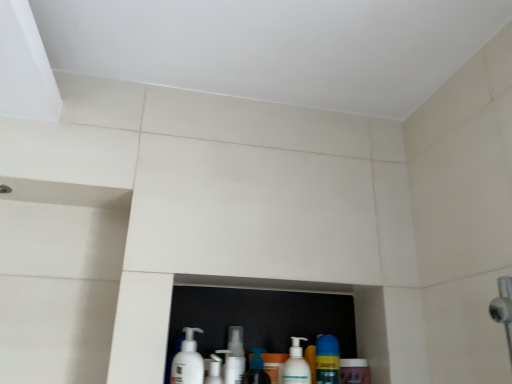
The image size is (512, 384). What do you see at coordinates (281, 314) in the screenshot?
I see `white plastic bottles at lower center` at bounding box center [281, 314].

Measure the distance between yellow matte bottle at lower center, the 5th cleaning product when ordered from left to right, and camera.

36.06 inches.

Image resolution: width=512 pixels, height=384 pixels. Find the location of `white plastic pump bottle at lower center, placed as the fourth cleaning product when sorted from left to right`. white plastic pump bottle at lower center, placed as the fourth cleaning product when sorted from left to right is located at coordinates (296, 365).

You are a GUI agent. You are given a task and a screenshot of the screen. Output one action in this format:
    pyautogui.click(x=<x>, y=<y>)
    Task: Click on the white plastic bottles at lower center
    The image size is (512, 384).
    Given the screenshot: What is the action you would take?
    pyautogui.click(x=281, y=314)

How different are the orientations of white plastic bottles at lower center and translucent plastic soap dispenser at center, which is counted as the third cleaning product, starting from the left, in degrees?

5.66 degrees separate the facing orientations of white plastic bottles at lower center and translucent plastic soap dispenser at center, which is counted as the third cleaning product, starting from the left.

From the image's perspective, relative to translucent plastic soap dispenser at center, acting as the 3th cleaning product starting from the right, is white plastic bottles at lower center above or below?

Based on their image positions, white plastic bottles at lower center is located above translucent plastic soap dispenser at center, acting as the 3th cleaning product starting from the right.

From the picture: Who is more distant, white plastic bottles at lower center or translucent plastic soap dispenser at center, acting as the 3th cleaning product starting from the right?

white plastic bottles at lower center.

Do you think white plastic bottles at lower center is within translucent plastic soap dispenser at center, which is counted as the third cleaning product, starting from the left, or outside of it?

white plastic bottles at lower center is not inside translucent plastic soap dispenser at center, which is counted as the third cleaning product, starting from the left, it's outside.

Considering the relative sizes of white matte pump bottle at lower center, the 5th cleaning product when ordered from right to left, and yellow matte bottle at lower center, the first cleaning product from the right, in the image provided, is white matte pump bottle at lower center, the 5th cleaning product when ordered from right to left, bigger than yellow matte bottle at lower center, the first cleaning product from the right,?

Yes.

From the image's perspective, is white matte pump bottle at lower center, the 1th cleaning product from the left, positioned above or below yellow matte bottle at lower center, the first cleaning product from the right?

white matte pump bottle at lower center, the 1th cleaning product from the left, is situated higher than yellow matte bottle at lower center, the first cleaning product from the right, in the image.

The height and width of the screenshot is (384, 512). I want to click on cleaning product above the yellow matte bottle at lower center, the first cleaning product from the right (from a real-world perspective), so click(x=188, y=361).

From a real-world perspective, who is located higher, white plastic pump bottle at lower center, placed as the fourth cleaning product when sorted from left to right, or white plastic bottles at lower center?

white plastic bottles at lower center.

Does white plastic pump bottle at lower center, placed as the fourth cleaning product when sorted from left to right, contain white plastic bottles at lower center?

No, white plastic bottles at lower center is not surrounded by white plastic pump bottle at lower center, placed as the fourth cleaning product when sorted from left to right.

Is white plastic pump bottle at lower center, the 2th cleaning product viewed from the right, in contact with white plastic bottles at lower center?

There is a gap between white plastic pump bottle at lower center, the 2th cleaning product viewed from the right, and white plastic bottles at lower center.

Does point (305, 365) appear closer or farther from the camera than point (369, 313)?

Clearly, point (305, 365) is closer to the camera than point (369, 313).

Considering the relative sizes of white plastic bottles at lower center and white plastic cup at center, which is the 2th cleaning product in left-to-right order, in the image provided, is white plastic bottles at lower center wider than white plastic cup at center, which is the 2th cleaning product in left-to-right order,?

Incorrect, the width of white plastic bottles at lower center does not surpass that of white plastic cup at center, which is the 2th cleaning product in left-to-right order.

Is white plastic bottles at lower center positioned in front of white plastic cup at center, the fourth cleaning product when ordered from right to left?

No, the depth of white plastic bottles at lower center is greater than that of white plastic cup at center, the fourth cleaning product when ordered from right to left.

Is point (332, 316) closer or farther from the camera than point (219, 375)?

Point (332, 316) is positioned farther from the camera compared to point (219, 375).

Choose the correct answer: Is white plastic bottles at lower center inside white plastic cup at center, the fourth cleaning product when ordered from right to left, or outside it?

white plastic bottles at lower center is not inside white plastic cup at center, the fourth cleaning product when ordered from right to left, it's outside.

At what (x,y) coordinates should I click in order to perform the action: click on shelf behind the translucent plastic soap dispenser at center, acting as the 3th cleaning product starting from the right. Please return your answer as a coordinate pair (x, y). The image size is (512, 384). Looking at the image, I should click on (281, 314).

Consider the image. From the image's perspective, would you say translucent plastic soap dispenser at center, acting as the 3th cleaning product starting from the right, is shown under white plastic bottles at lower center?

Yes, from the image's perspective, translucent plastic soap dispenser at center, acting as the 3th cleaning product starting from the right, is below white plastic bottles at lower center.

Is translucent plastic soap dispenser at center, acting as the 3th cleaning product starting from the right, not near white plastic bottles at lower center?

No, there isn't a large distance between translucent plastic soap dispenser at center, acting as the 3th cleaning product starting from the right, and white plastic bottles at lower center.

Could you measure the distance between translucent plastic soap dispenser at center, which is counted as the third cleaning product, starting from the left, and white plastic bottles at lower center?

translucent plastic soap dispenser at center, which is counted as the third cleaning product, starting from the left, is 8.06 inches from white plastic bottles at lower center.

Between white plastic pump bottle at lower center, the 2th cleaning product viewed from the right, and white matte pump bottle at lower center, the 5th cleaning product when ordered from right to left, which one appears on the left side from the viewer's perspective?

From the viewer's perspective, white matte pump bottle at lower center, the 5th cleaning product when ordered from right to left, appears more on the left side.

Based on the photo, from a real-world perspective, which is physically below, white plastic pump bottle at lower center, placed as the fourth cleaning product when sorted from left to right, or white matte pump bottle at lower center, the 5th cleaning product when ordered from right to left?

From a 3D spatial view, white plastic pump bottle at lower center, placed as the fourth cleaning product when sorted from left to right, is below.

Considering the sizes of objects white plastic pump bottle at lower center, the 2th cleaning product viewed from the right, and white matte pump bottle at lower center, the 5th cleaning product when ordered from right to left, in the image provided, who is thinner, white plastic pump bottle at lower center, the 2th cleaning product viewed from the right, or white matte pump bottle at lower center, the 5th cleaning product when ordered from right to left,?

white plastic pump bottle at lower center, the 2th cleaning product viewed from the right, is thinner.

The width and height of the screenshot is (512, 384). In order to click on the 2nd cleaning product in front of the white plastic pump bottle at lower center, placed as the fourth cleaning product when sorted from left to right, counting from the anchor's position in this screenshot , I will do `click(188, 361)`.

Between yellow matte bottle at lower center, the 5th cleaning product when ordered from left to right, and white plastic pump bottle at lower center, the 2th cleaning product viewed from the right, which one has larger width?

With larger width is yellow matte bottle at lower center, the 5th cleaning product when ordered from left to right.

From a real-world perspective, who is located lower, yellow matte bottle at lower center, the 5th cleaning product when ordered from left to right, or white plastic pump bottle at lower center, the 2th cleaning product viewed from the right?

white plastic pump bottle at lower center, the 2th cleaning product viewed from the right.

Is yellow matte bottle at lower center, the first cleaning product from the right, far away from white plastic pump bottle at lower center, placed as the fourth cleaning product when sorted from left to right?

No.

Is white plastic pump bottle at lower center, the 2th cleaning product viewed from the right, located within yellow matte bottle at lower center, the first cleaning product from the right?

Actually, white plastic pump bottle at lower center, the 2th cleaning product viewed from the right, is outside yellow matte bottle at lower center, the first cleaning product from the right.

In order to click on shelf above the translucent plastic soap dispenser at center, acting as the 3th cleaning product starting from the right (from a real-world perspective) in this screenshot , I will do `click(281, 314)`.

The height and width of the screenshot is (384, 512). In order to click on the 3rd cleaning product below the white matte pump bottle at lower center, the 5th cleaning product when ordered from right to left (from the image's perspective) in this screenshot , I will do `click(327, 359)`.

From the image, which object appears to be farther from white plastic bottles at lower center, white plastic cup at center, which is the 2th cleaning product in left-to-right order, or translucent plastic soap dispenser at center, acting as the 3th cleaning product starting from the right?

white plastic cup at center, which is the 2th cleaning product in left-to-right order, lies further to white plastic bottles at lower center than the other object.

Which object lies nearer to the anchor point white matte pump bottle at lower center, the 5th cleaning product when ordered from right to left, white plastic cup at center, the fourth cleaning product when ordered from right to left, or white plastic bottles at lower center?

white plastic cup at center, the fourth cleaning product when ordered from right to left, is closer to white matte pump bottle at lower center, the 5th cleaning product when ordered from right to left.

From the picture: Which object lies further to the anchor point white plastic bottles at lower center, white plastic pump bottle at lower center, placed as the fourth cleaning product when sorted from left to right, or white plastic cup at center, the fourth cleaning product when ordered from right to left?

white plastic cup at center, the fourth cleaning product when ordered from right to left, is positioned further to the anchor white plastic bottles at lower center.

When comparing their distances from white plastic bottles at lower center, does white plastic pump bottle at lower center, the 2th cleaning product viewed from the right, or yellow matte bottle at lower center, the first cleaning product from the right, seem closer?

yellow matte bottle at lower center, the first cleaning product from the right, is positioned closer to the anchor white plastic bottles at lower center.

Based on their spatial positions, is yellow matte bottle at lower center, the first cleaning product from the right, or white plastic pump bottle at lower center, placed as the fourth cleaning product when sorted from left to right, closer to translucent plastic soap dispenser at center, acting as the 3th cleaning product starting from the right?

Based on the image, white plastic pump bottle at lower center, placed as the fourth cleaning product when sorted from left to right, appears to be nearer to translucent plastic soap dispenser at center, acting as the 3th cleaning product starting from the right.

When comparing their distances from white plastic pump bottle at lower center, placed as the fourth cleaning product when sorted from left to right, does white plastic cup at center, the fourth cleaning product when ordered from right to left, or translucent plastic soap dispenser at center, which is counted as the third cleaning product, starting from the left, seem further?

white plastic cup at center, the fourth cleaning product when ordered from right to left, lies further to white plastic pump bottle at lower center, placed as the fourth cleaning product when sorted from left to right, than the other object.

Which object lies nearer to the anchor point white plastic bottles at lower center, translucent plastic soap dispenser at center, acting as the 3th cleaning product starting from the right, or white plastic pump bottle at lower center, placed as the fourth cleaning product when sorted from left to right?

Based on the image, white plastic pump bottle at lower center, placed as the fourth cleaning product when sorted from left to right, appears to be nearer to white plastic bottles at lower center.

Estimate the real-world distances between objects in this image. Which object is closer to white plastic cup at center, which is the 2th cleaning product in left-to-right order, yellow matte bottle at lower center, the 5th cleaning product when ordered from left to right, or white plastic pump bottle at lower center, placed as the fourth cleaning product when sorted from left to right?

white plastic pump bottle at lower center, placed as the fourth cleaning product when sorted from left to right, is positioned closer to the anchor white plastic cup at center, which is the 2th cleaning product in left-to-right order.

Where is `cleaning product between translucent plastic soap dispenser at center, acting as the 3th cleaning product starting from the right, and yellow matte bottle at lower center, the first cleaning product from the right, from left to right`? Image resolution: width=512 pixels, height=384 pixels. cleaning product between translucent plastic soap dispenser at center, acting as the 3th cleaning product starting from the right, and yellow matte bottle at lower center, the first cleaning product from the right, from left to right is located at coordinates (296, 365).

Where is `shelf between white plastic cup at center, the fourth cleaning product when ordered from right to left, and white plastic pump bottle at lower center, placed as the fourth cleaning product when sorted from left to right, from left to right`? shelf between white plastic cup at center, the fourth cleaning product when ordered from right to left, and white plastic pump bottle at lower center, placed as the fourth cleaning product when sorted from left to right, from left to right is located at coordinates (281, 314).

Image resolution: width=512 pixels, height=384 pixels. Find the location of `shelf situated between white plastic cup at center, which is the 2th cleaning product in left-to-right order, and yellow matte bottle at lower center, the first cleaning product from the right, from left to right`. shelf situated between white plastic cup at center, which is the 2th cleaning product in left-to-right order, and yellow matte bottle at lower center, the first cleaning product from the right, from left to right is located at coordinates (281, 314).

At what (x,y) coordinates should I click in order to perform the action: click on cleaning product situated between white matte pump bottle at lower center, the 1th cleaning product from the left, and translucent plastic soap dispenser at center, which is counted as the third cleaning product, starting from the left, from left to right. Please return your answer as a coordinate pair (x, y). Looking at the image, I should click on (213, 370).